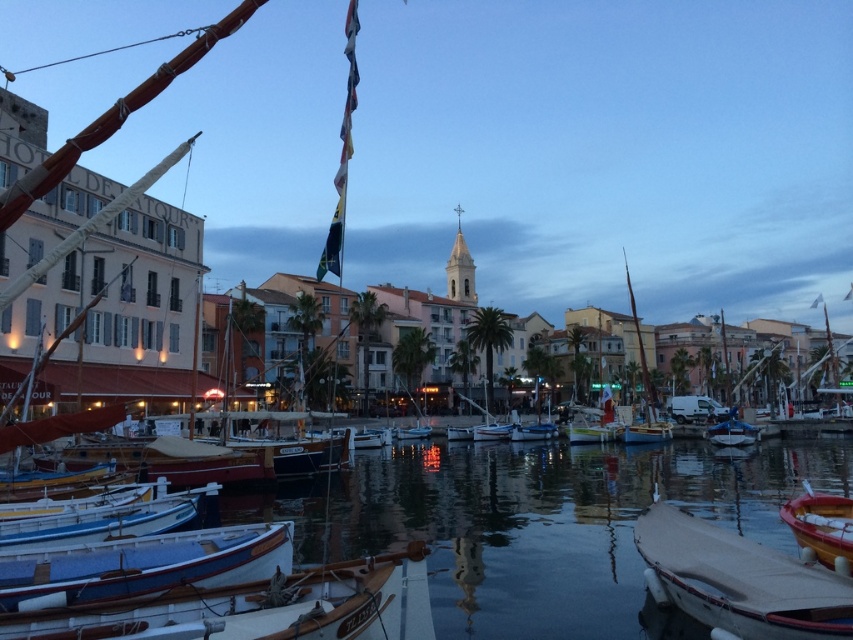
Question: Can you confirm if blue wooden boat at lower left is wider than wooden sailboat at center?

Choices:
 (A) yes
 (B) no

Answer: (B)

Question: Which of the following is the closest to the observer?

Choices:
 (A) wooden sailboat at center
 (B) wooden boat at lower right

Answer: (B)

Question: Which point is closer to the camera?

Choices:
 (A) (697, 461)
 (B) (714, 525)

Answer: (B)

Question: Can you confirm if blue wooden boat at lower left is bigger than yellow-orange wooden boat at lower right?

Choices:
 (A) yes
 (B) no

Answer: (B)

Question: Which point is closer to the camera taking this photo?

Choices:
 (A) (819, 625)
 (B) (737, 428)
 (C) (257, 544)

Answer: (A)

Question: Does wooden boat at lower right appear under wooden sailboat at center?

Choices:
 (A) yes
 (B) no

Answer: (A)